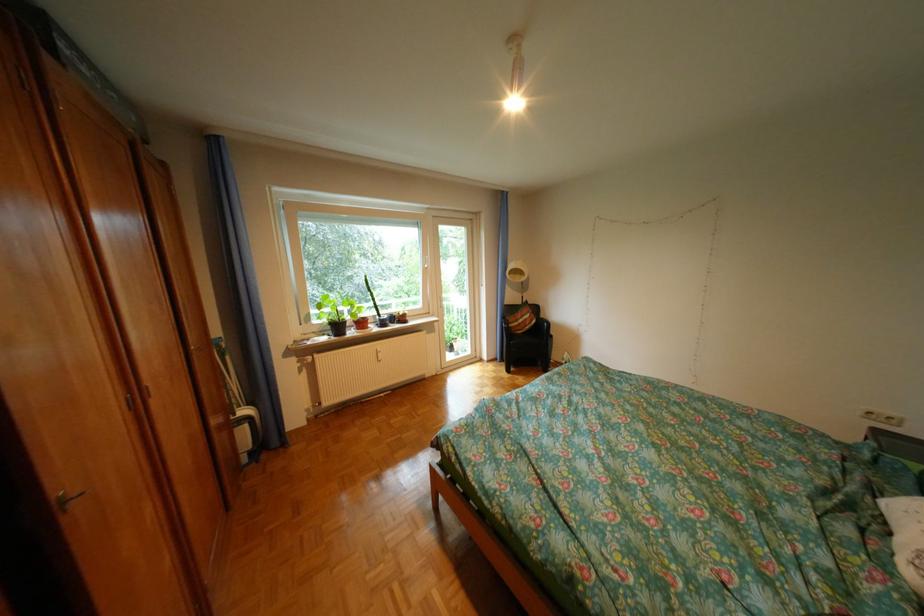
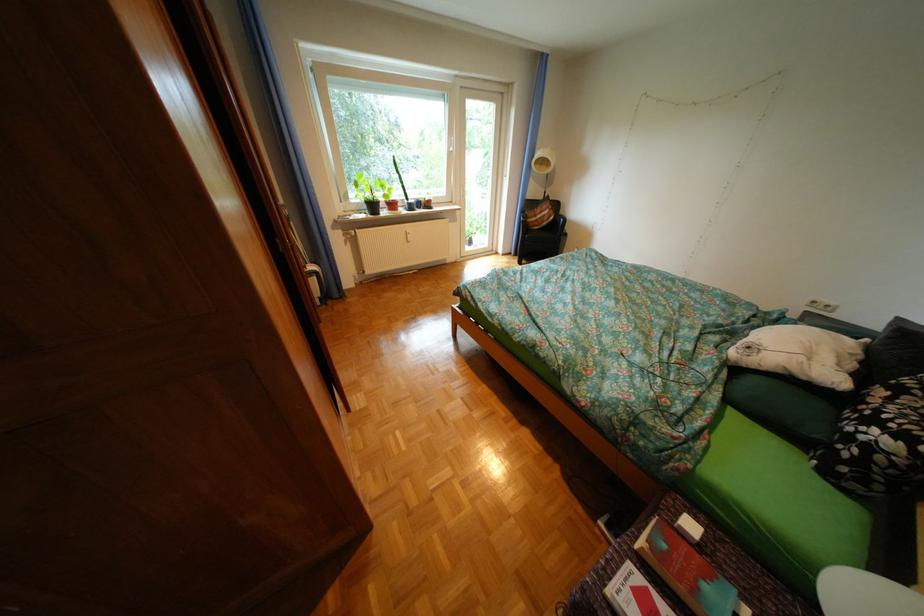
Find the pixel in the second image that matches (x=330, y=323) in the first image.

(368, 201)